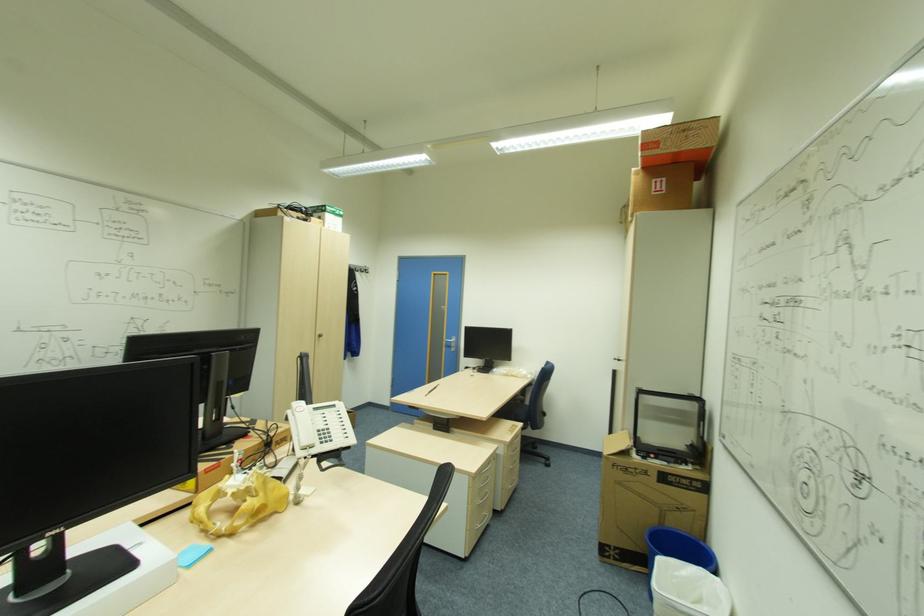
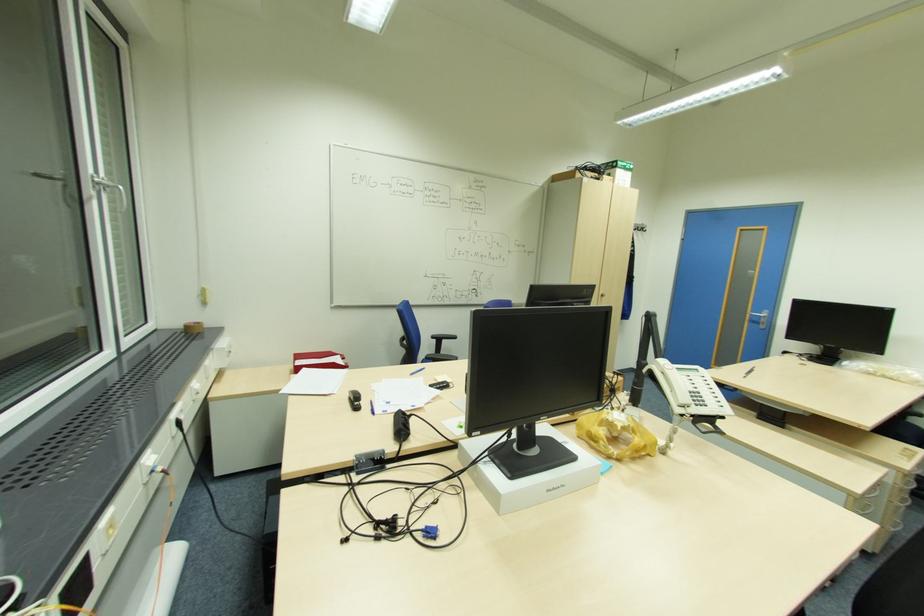
Locate, in the second image, the point that corresponds to point 456,346 in the first image.

(766, 323)